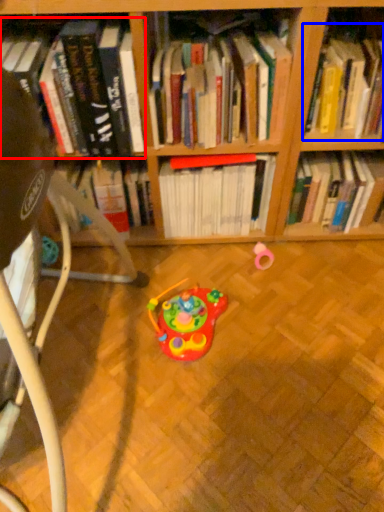
Question: Among these objects, which one is farthest to the camera, book (highlighted by a red box) or book (highlighted by a blue box)?

Choices:
 (A) book
 (B) book

Answer: (B)